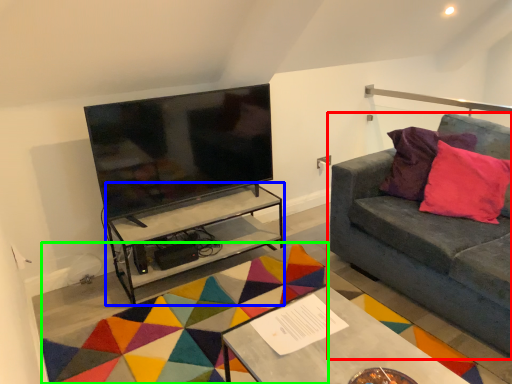
Question: Based on their relative distances, which object is nearer to studio couch (highlighted by a red box)? Choose from table (highlighted by a blue box) and mat (highlighted by a green box).

Choices:
 (A) table
 (B) mat

Answer: (B)